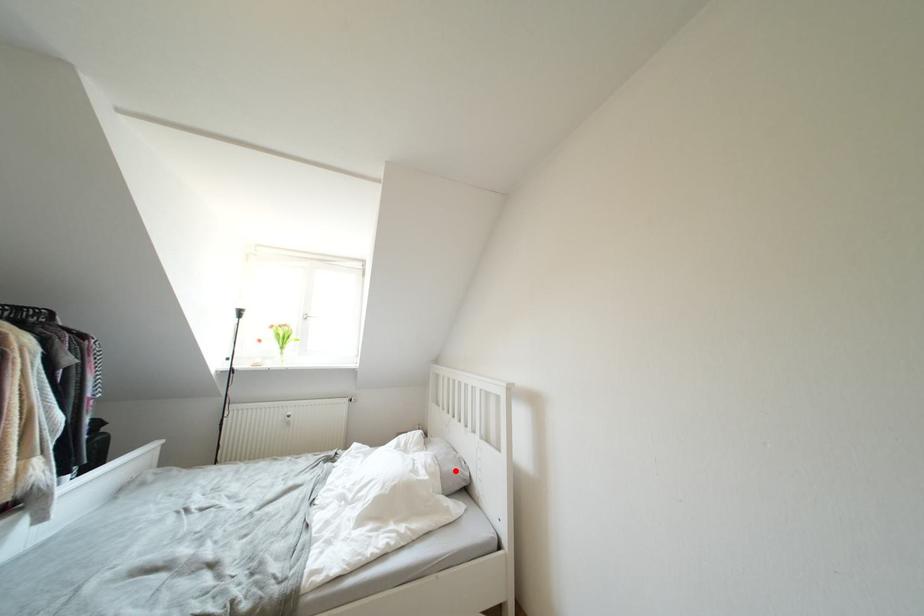
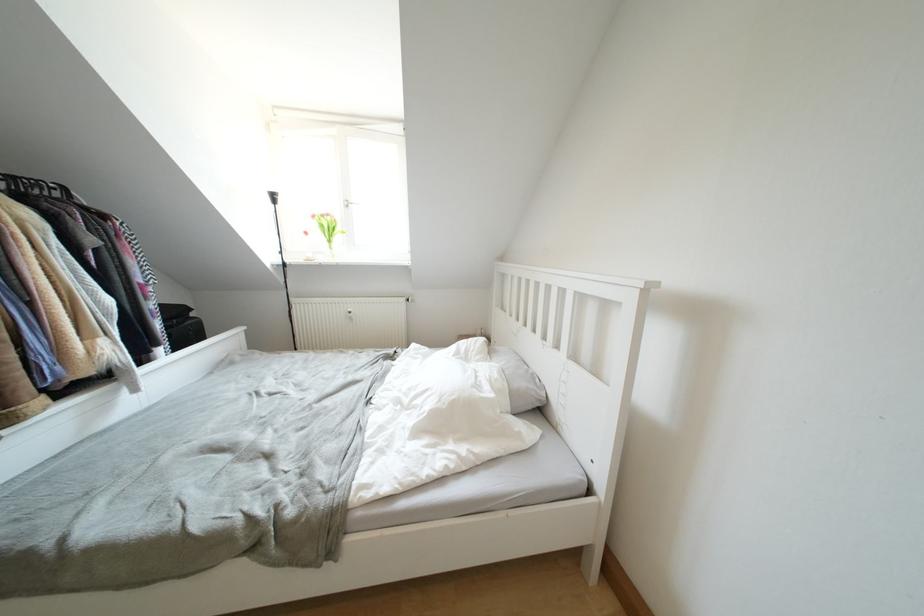
Find the pixel in the second image that matches the highlighted location in the first image.

(527, 387)